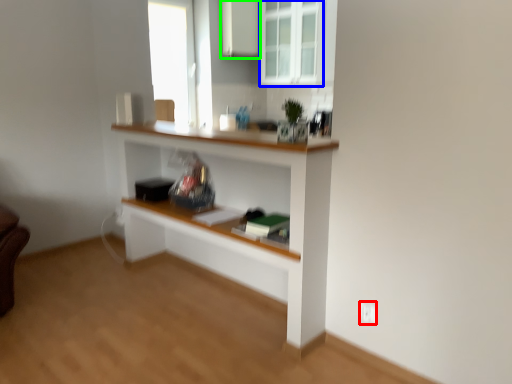
Question: Which object is positioned farthest from electric outlet (highlighted by a red box)? Select from window (highlighted by a blue box) and cabinetry (highlighted by a green box).

Choices:
 (A) window
 (B) cabinetry

Answer: (B)